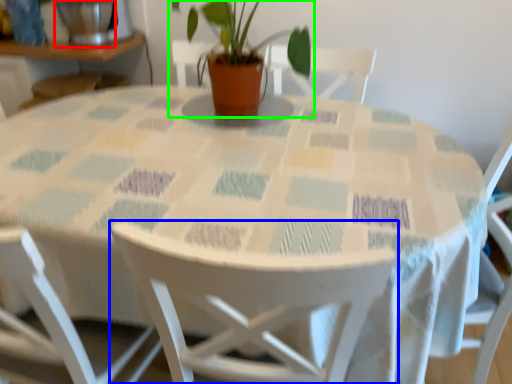
Question: Which object is the farthest from glass vase (highlighted by a red box)? Choose among these: chair (highlighted by a blue box) or houseplant (highlighted by a green box).

Choices:
 (A) chair
 (B) houseplant

Answer: (A)